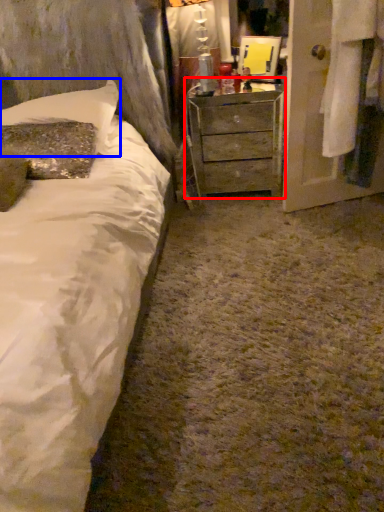
Question: Which point is further to the camera, chest of drawers (highlighted by a red box) or pillow (highlighted by a blue box)?

Choices:
 (A) chest of drawers
 (B) pillow

Answer: (A)